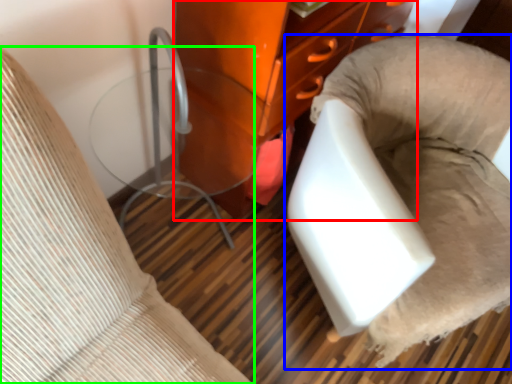
Question: Considering the real-world distances, which object is closest to furniture (highlighted by a red box)? furniture (highlighted by a blue box) or furniture (highlighted by a green box).

Choices:
 (A) furniture
 (B) furniture

Answer: (A)